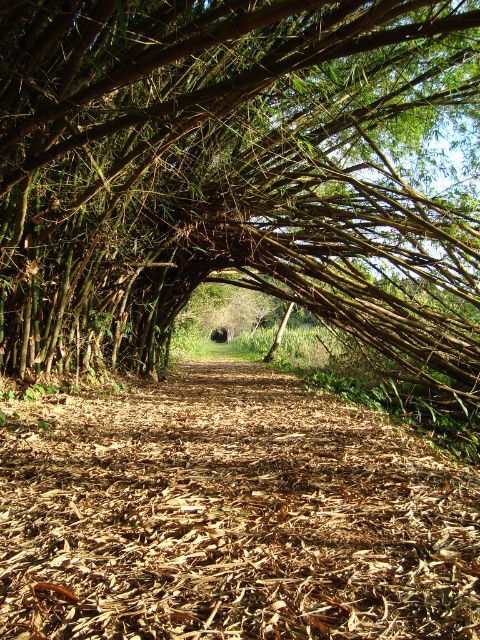
Question: Considering the relative positions of green leafy tree at center and brown mulch trail at center in the image provided, where is green leafy tree at center located with respect to brown mulch trail at center?

Choices:
 (A) left
 (B) right

Answer: (B)

Question: Which point appears closest to the camera in this image?

Choices:
 (A) (454, 492)
 (B) (242, 253)

Answer: (A)

Question: Which of the following is the closest to the observer?

Choices:
 (A) (397, 620)
 (B) (452, 291)

Answer: (A)

Question: From the image, what is the correct spatial relationship of green leafy tree at center in relation to brown mulch trail at center?

Choices:
 (A) right
 (B) left

Answer: (A)

Question: Can you confirm if green leafy tree at center is thinner than brown mulch trail at center?

Choices:
 (A) no
 (B) yes

Answer: (A)